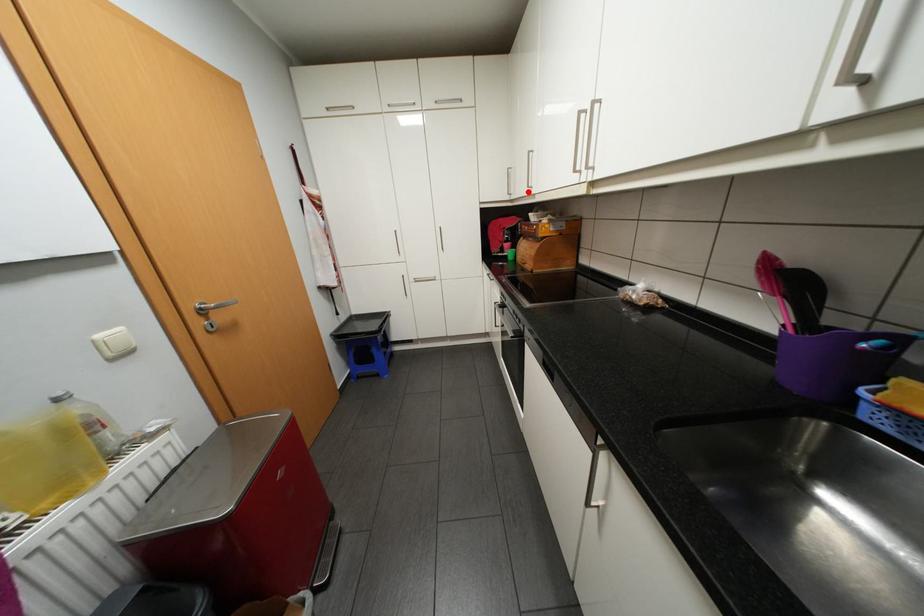
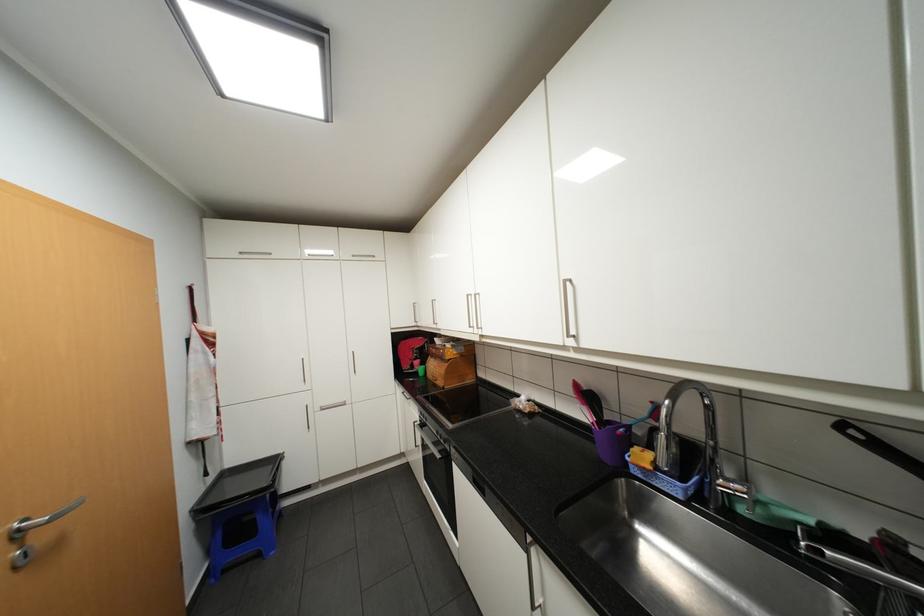
The point at the highlighted location is marked in the first image. Where is the corresponding point in the second image?

(434, 323)